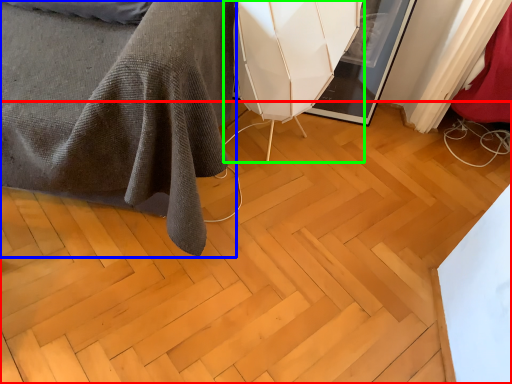
Question: Estimate the real-world distances between objects in this image. Which object is closer to plywood (highlighted by a red box), furniture (highlighted by a blue box) or swivel chair (highlighted by a green box)?

Choices:
 (A) furniture
 (B) swivel chair

Answer: (A)